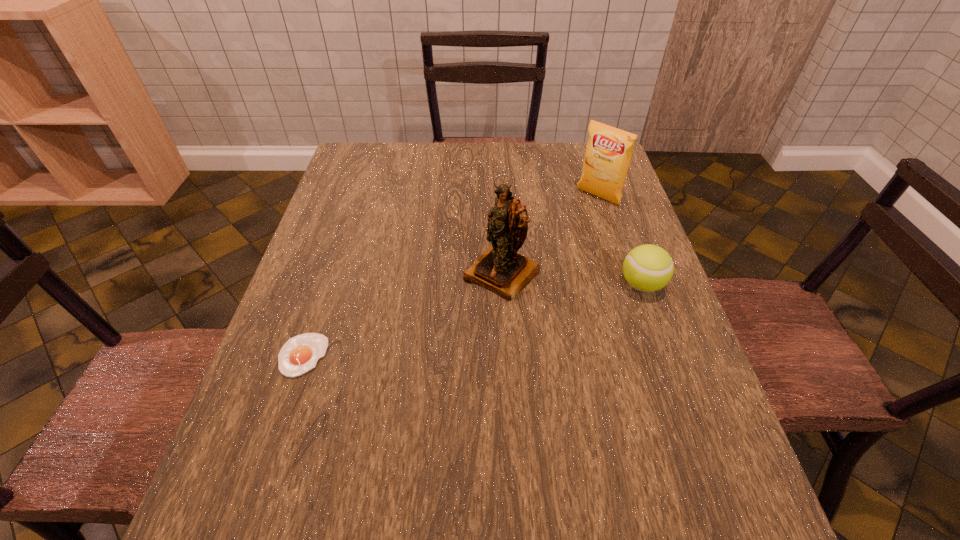
Locate an element on the screen. empty space that is in between the second shortest object and the shortest object is located at coordinates (472, 320).

Locate an element on the screen. This screenshot has height=540, width=960. unoccupied position between the second shortest object and the leftmost object is located at coordinates (472, 320).

Identify the location of empty space that is in between the crisp (potato chip) and the tennis ball. The width and height of the screenshot is (960, 540). (620, 241).

Identify the location of free space between the farthest object and the tennis ball. This screenshot has height=540, width=960. (620, 241).

Select which object is the closest to the tennis ball. Please provide its 2D coordinates. Your answer should be formatted as a tuple, i.e. [(x, y)], where the tuple contains the x and y coordinates of a point satisfying the conditions above.

[(500, 269)]

Identify which object is located as the nearest to the leftmost object. Please provide its 2D coordinates. Your answer should be formatted as a tuple, i.e. [(x, y)], where the tuple contains the x and y coordinates of a point satisfying the conditions above.

[(500, 269)]

Identify the location of vacant position in the image that satisfies the following two spatial constraints: 1. on the back side of the egg yolk; 2. on the right side of the figurine. (330, 273).

The width and height of the screenshot is (960, 540). What are the coordinates of `free point that satisfies the following two spatial constraints: 1. on the back side of the tennis ball; 2. on the left side of the nearest object` in the screenshot? It's located at (325, 285).